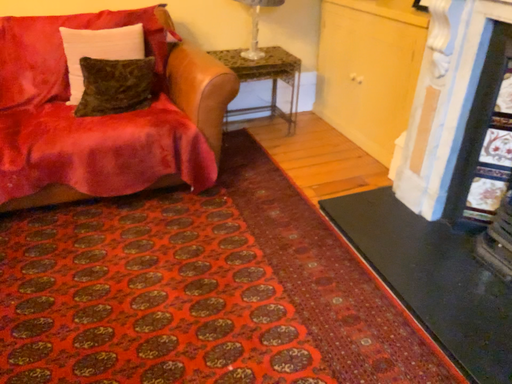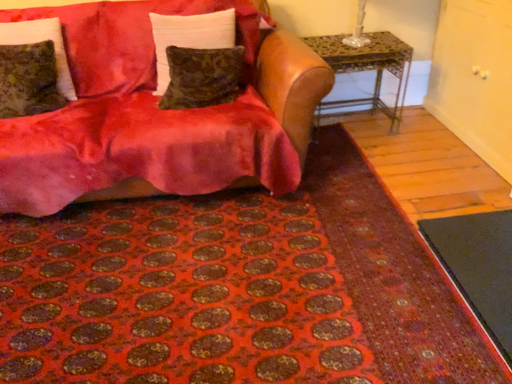
Question: How did the camera likely rotate when shooting the video?

Choices:
 (A) rotated right
 (B) rotated left

Answer: (B)